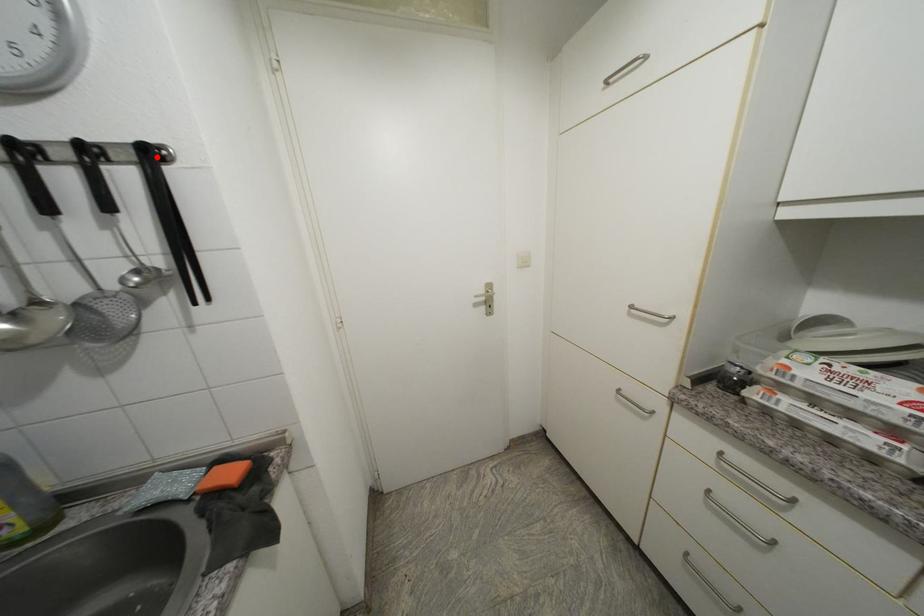
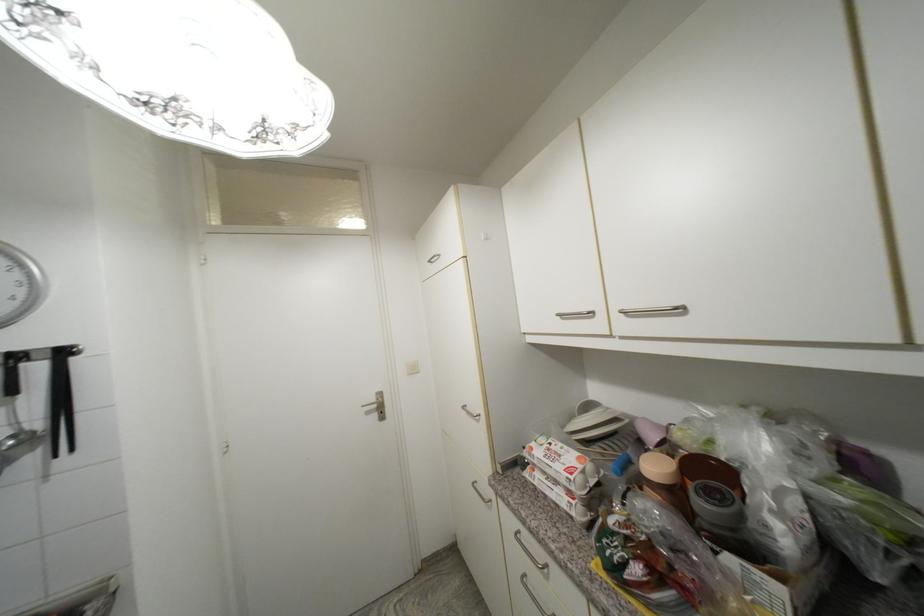
Locate, in the second image, the point that corresponds to the highlighted location in the first image.

(69, 354)